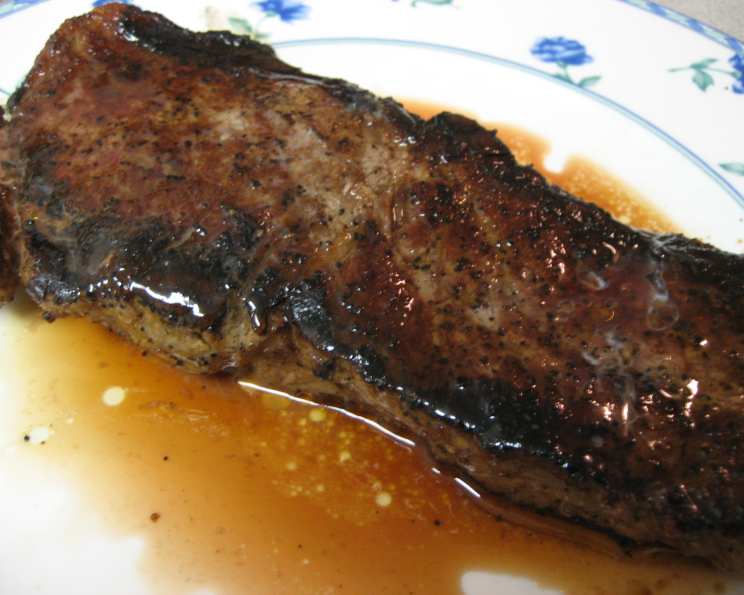
Identify the location of table space. (725, 20).